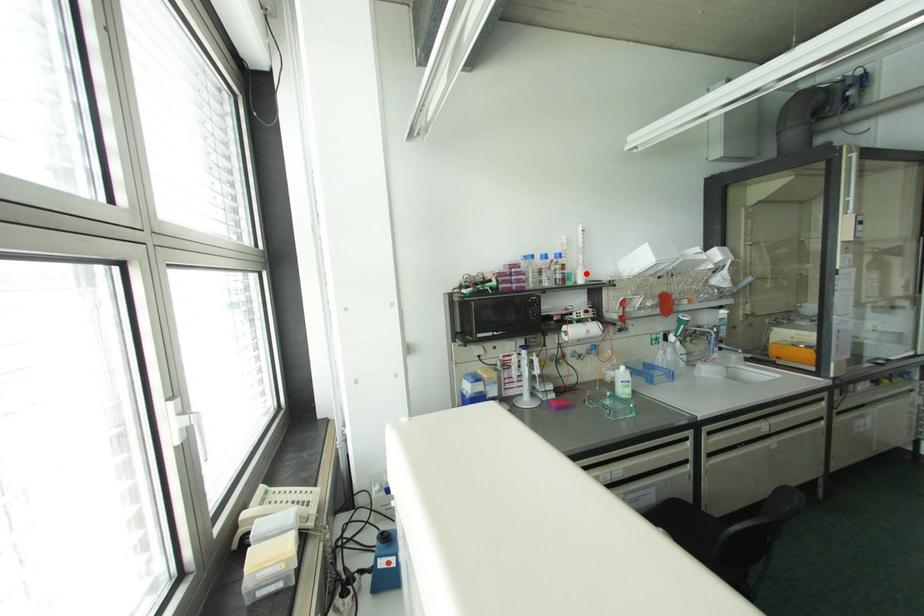
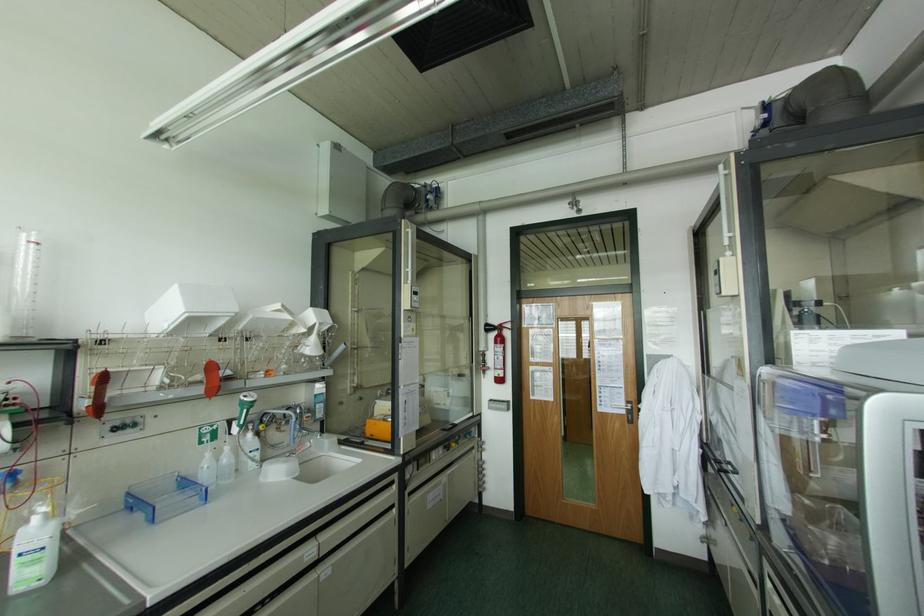
Find the pixel in the second image that matches the highlighted location in the first image.

(16, 323)